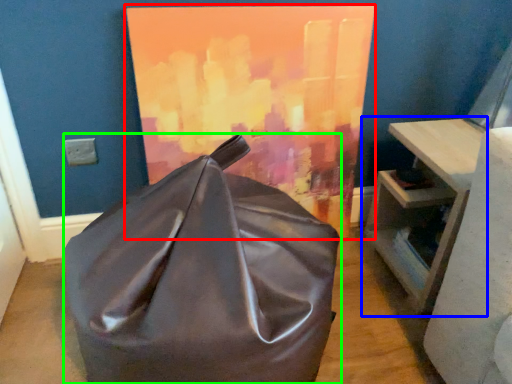
Question: Which is nearer to the oil painting (highlighted by a red box)? table (highlighted by a blue box) or furniture (highlighted by a green box).

Choices:
 (A) table
 (B) furniture

Answer: (A)